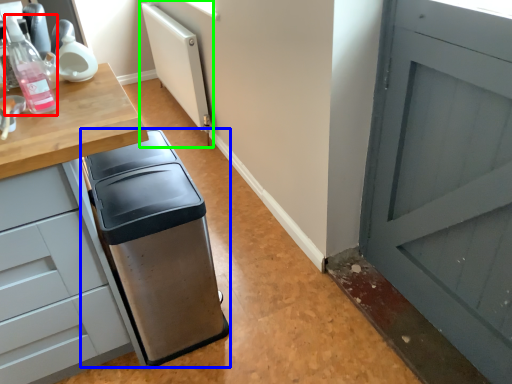
Question: Estimate the real-world distances between objects in this image. Which object is farther from bottle (highlighted by a red box), waste container (highlighted by a blue box) or radiator (highlighted by a green box)?

Choices:
 (A) waste container
 (B) radiator

Answer: (B)